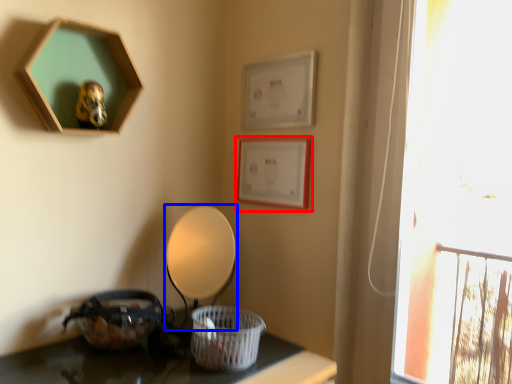
Question: Which object is closer to the camera taking this photo, picture frame (highlighted by a red box) or table lamp (highlighted by a blue box)?

Choices:
 (A) picture frame
 (B) table lamp

Answer: (B)